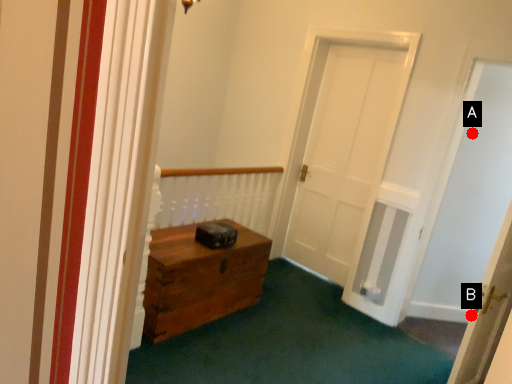
Question: Two points are circled on the image, labeled by A and B beside each circle. Which point appears farthest from the camera in this image?

Choices:
 (A) A is further
 (B) B is further

Answer: (B)